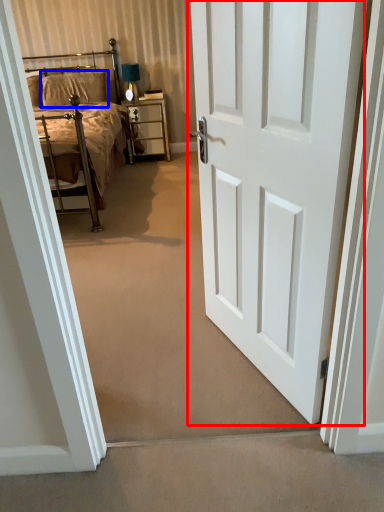
Question: Which point is further to the camera, door (highlighted by a red box) or pillow (highlighted by a blue box)?

Choices:
 (A) door
 (B) pillow

Answer: (B)